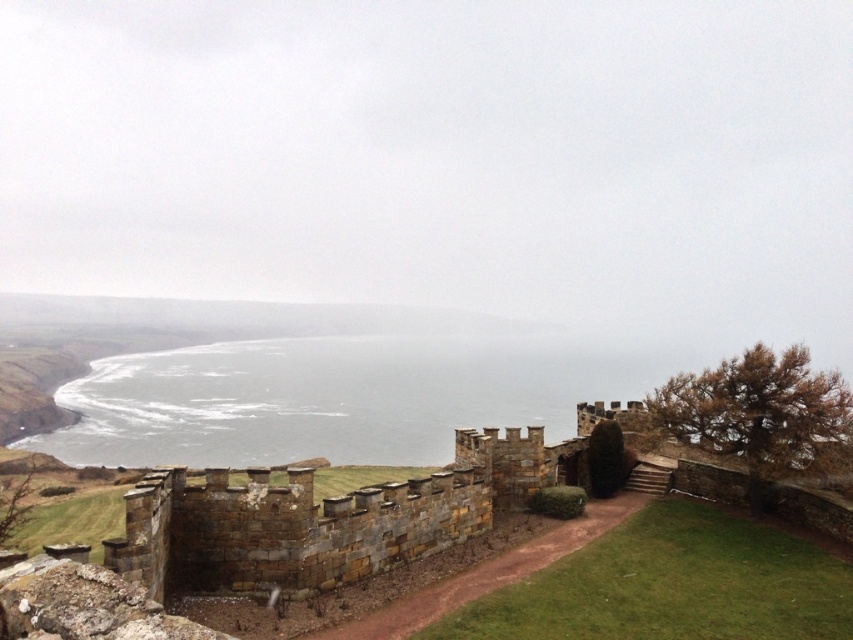
Question: Is gray water at center above brown stone wall at center?

Choices:
 (A) yes
 (B) no

Answer: (B)

Question: Which point appears closest to the camera in this image?

Choices:
 (A) (270, 506)
 (B) (355, 436)

Answer: (A)

Question: Is gray water at center below brown stone wall at center?

Choices:
 (A) no
 (B) yes

Answer: (B)

Question: Which object appears farthest from the camera in this image?

Choices:
 (A) brown stone wall at center
 (B) gray water at center

Answer: (B)

Question: Is gray water at center smaller than brown stone wall at center?

Choices:
 (A) yes
 (B) no

Answer: (B)